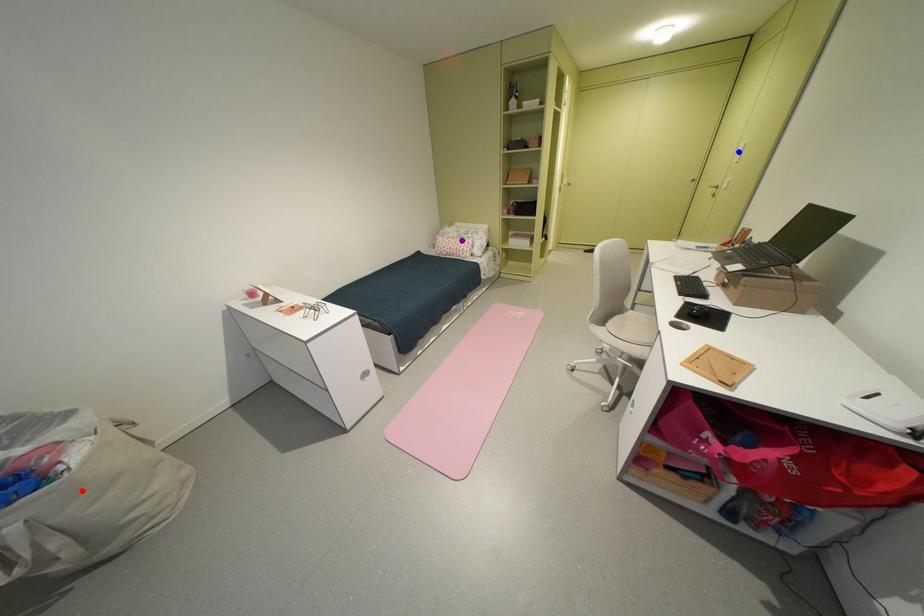
Order these from nearest to farthest:
red point, purple point, blue point

red point < blue point < purple point